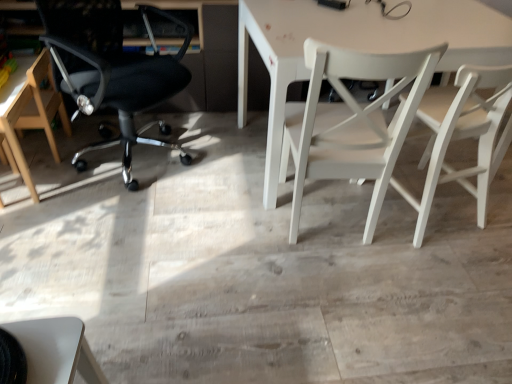
This screenshot has width=512, height=384. Identify the location of free space in front of white wood chair at right, which is the 1th chair in right-to-left order. (437, 267).